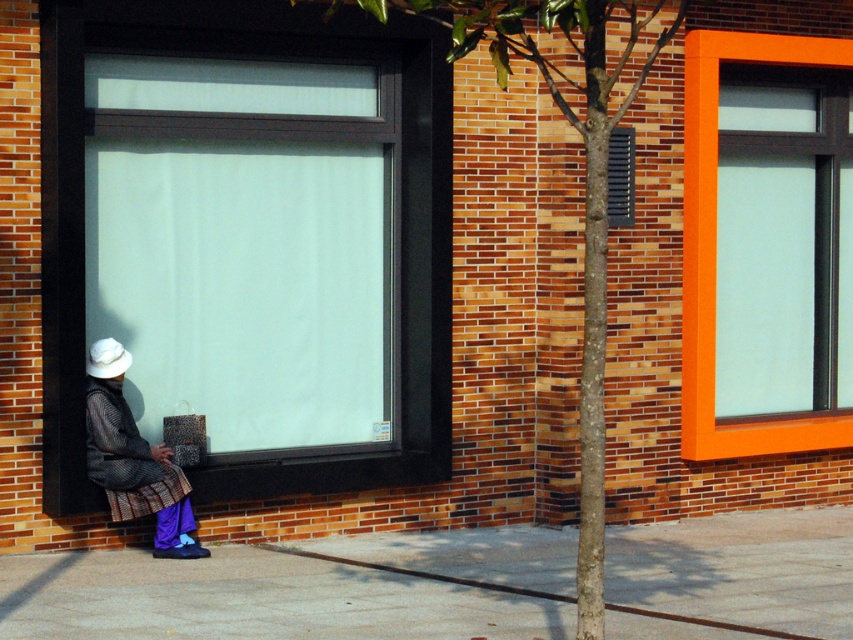
You are an architect designing a new building and need to compare the sizes of the windows. Which of the two windows, the matte glass window at center or the orange frame glass window at upper right, has a larger surface area?

The matte glass window at center has a larger surface area than the orange frame glass window at upper right because it is bigger according to the description.

What is the exact coordinate of the smooth bark tree at center?

The smooth bark tree at center is located at point (x=584, y=176).